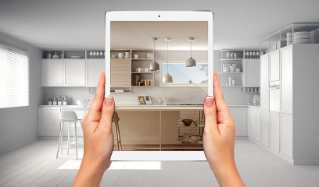
Identify the location of window. Image resolution: width=319 pixels, height=187 pixels. (187, 78).